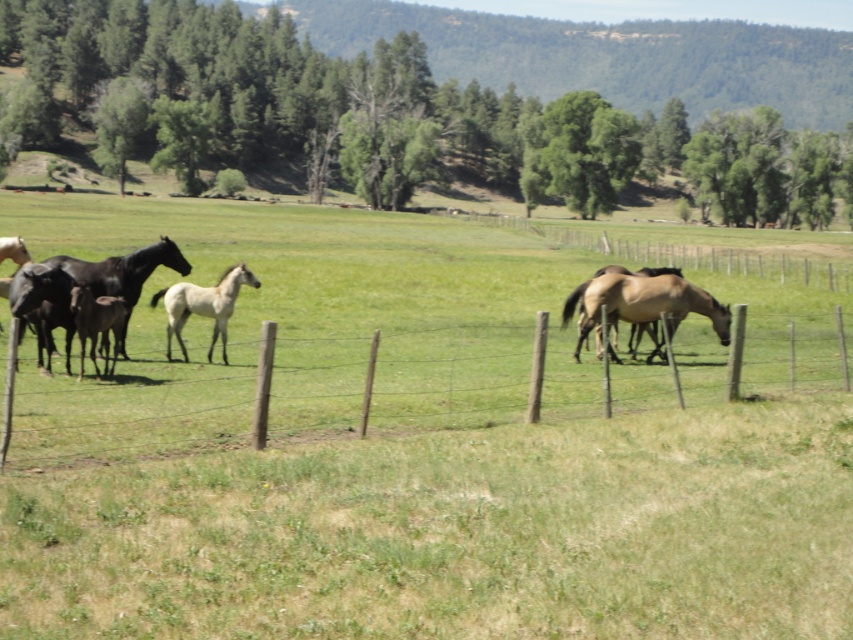
Question: Observing the image, what is the correct spatial positioning of green grassy field at center in reference to black glossy horse at left?

Choices:
 (A) left
 (B) right

Answer: (B)

Question: Among these points, which one is nearest to the camera?

Choices:
 (A) (578, 612)
 (B) (80, 344)

Answer: (A)

Question: Is wooden post fence at lower center smaller than brown glossy horse at center?

Choices:
 (A) no
 (B) yes

Answer: (A)

Question: Which object is positioned closest to the wooden post fence at lower center?

Choices:
 (A) green grassy field at center
 (B) black glossy horse at left
 (C) white glossy horse at center

Answer: (C)

Question: Can you confirm if green grassy field at center is positioned above black glossy horse at left?

Choices:
 (A) no
 (B) yes

Answer: (B)

Question: Based on their relative distances, which object is nearer to the wooden post fence at lower center?

Choices:
 (A) dark brown glossy horse at left
 (B) brown glossy horse at center
 (C) white glossy horse at center

Answer: (B)